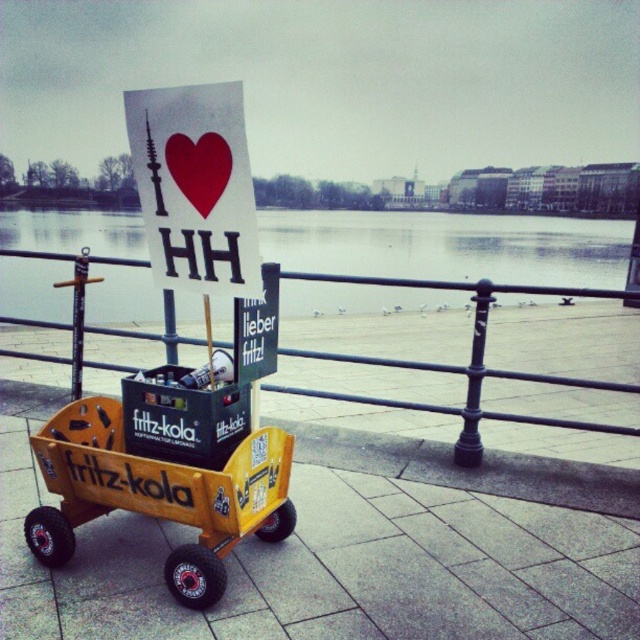
You are a tourist standing in the street scene by the waterfront. You want to take a photo of the yellow wood cart at center and the green matte sign at center. Which object should you focus on first to ensure both are in the frame?

The yellow wood cart at center is positioned under the green matte sign at center, so you should focus on the green matte sign at center first to ensure both are in the frame.

You are a photographer standing in the waterfront area. You want to take a photo of the yellow wood cart at center and the green matte sign at center such that the cart is not blocked by anything. Based on the scene, is the current arrangement suitable for your photo?

The yellow wood cart at center is in front of the green matte sign at center, so the cart will block the sign in the photo. To ensure both are visible, adjust the cart or sign positions so neither blocks the other.

You are a delivery drone with a wingspan of 4 feet. You need to fly from the yellow wood cart at center to the white paper sign at upper center. Can your drone safely navigate the space between them without touching anything?

The distance between the yellow wood cart at center and the white paper sign at upper center is 5.15 feet. Since your drone has a wingspan of 4 feet, it can safely navigate the space between them without touching anything.